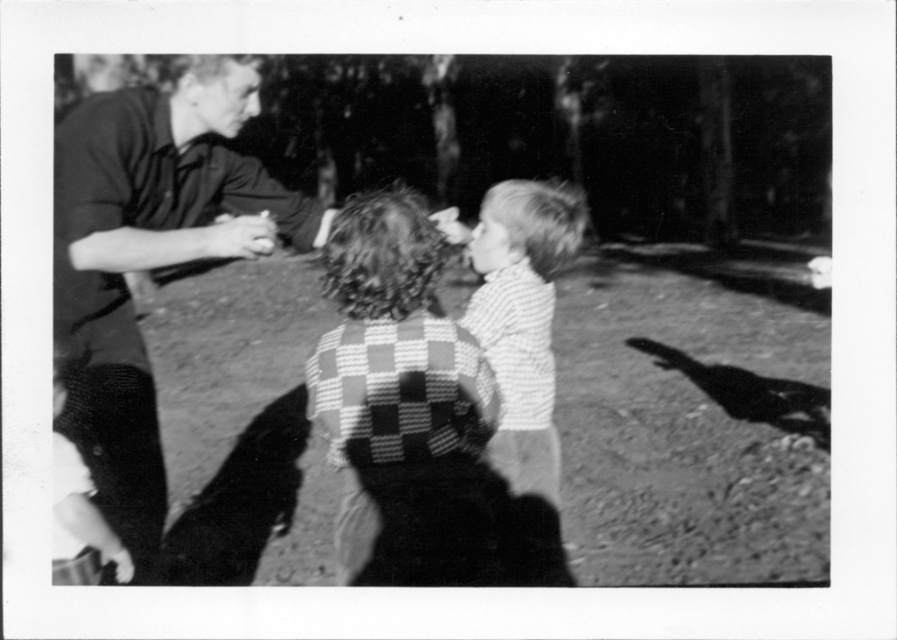
Is checkered fabric sweater at center to the right of striped cotton shirt at center from the viewer's perspective?

Incorrect, checkered fabric sweater at center is not on the right side of striped cotton shirt at center.

Describe the element at coordinates (397, 397) in the screenshot. The height and width of the screenshot is (640, 897). I see `checkered fabric sweater at center` at that location.

Locate an element on the screen. The image size is (897, 640). checkered fabric sweater at center is located at coordinates (397, 397).

Who is shorter, smooth dark shirt at left or striped cotton shirt at center?

striped cotton shirt at center

Is smooth dark shirt at left to the left of striped cotton shirt at center from the viewer's perspective?

Correct, you'll find smooth dark shirt at left to the left of striped cotton shirt at center.

Is point (85, 132) in front of point (501, 456)?

Yes, point (85, 132) is in front of point (501, 456).

The height and width of the screenshot is (640, 897). What are the coordinates of `smooth dark shirt at left` in the screenshot? It's located at (147, 253).

Who is taller, smooth dark shirt at left or checkered fabric sweater at center?

With more height is smooth dark shirt at left.

Does smooth dark shirt at left lie behind checkered fabric sweater at center?

That is True.

At what (x,y) coordinates should I click in order to perform the action: click on smooth dark shirt at left. Please return your answer as a coordinate pair (x, y). This screenshot has width=897, height=640. Looking at the image, I should click on (147, 253).

At what (x,y) coordinates should I click in order to perform the action: click on smooth dark shirt at left. Please return your answer as a coordinate pair (x, y). Looking at the image, I should click on (147, 253).